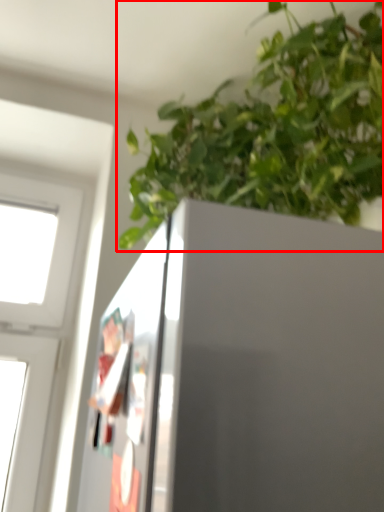
Question: From the image's perspective, what is the correct spatial positioning of houseplant (annotated by the red box) in reference to screen door?

Choices:
 (A) above
 (B) below

Answer: (A)